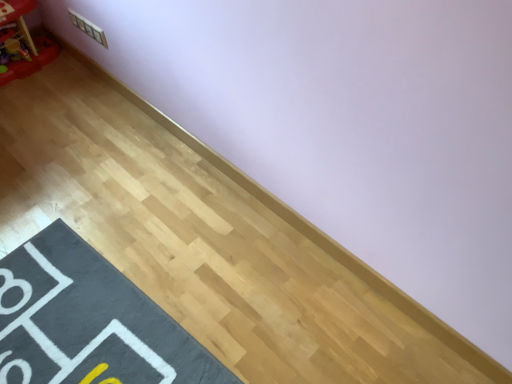
I want to click on free point in front of matte plastic toy storage at upper left, so click(x=26, y=99).